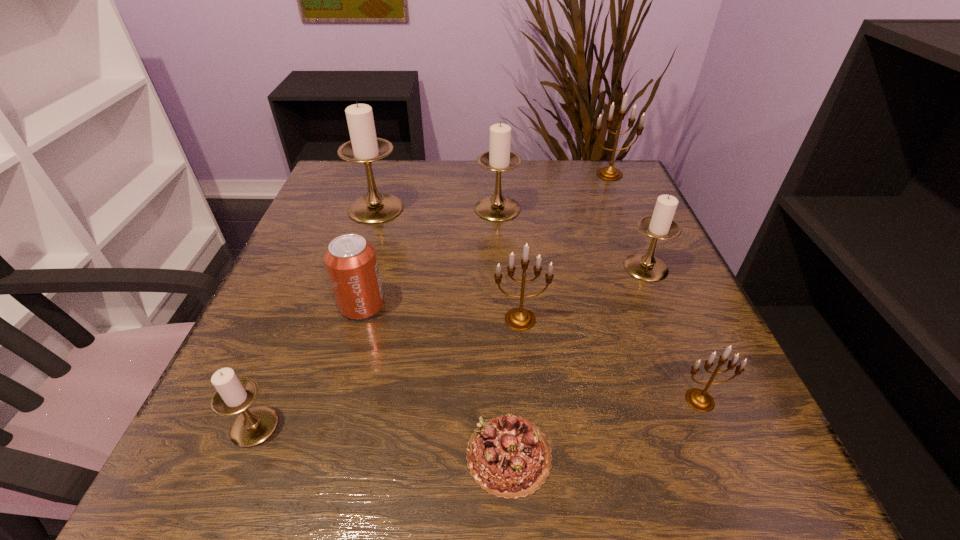
The image size is (960, 540). In the image, there is a desktop. In order to click on vacant space at the left edge in this screenshot , I will do `click(262, 363)`.

You are a GUI agent. You are given a task and a screenshot of the screen. Output one action in this format:
    pyautogui.click(x=<x>, y=<y>)
    Task: Click on the vacant space at the right edge of the desktop
    
    Given the screenshot: What is the action you would take?
    pyautogui.click(x=665, y=247)

Where is `vacant space at the far left corner`? vacant space at the far left corner is located at coordinates (329, 187).

At what (x,y) coordinates should I click in order to perform the action: click on vacant space at the near left corner of the desktop. Please return your answer as a coordinate pair (x, y). The width and height of the screenshot is (960, 540). Looking at the image, I should click on (268, 488).

In the image, there is a desktop. At what (x,y) coordinates should I click in order to perform the action: click on vacant space at the far right corner. Please return your answer as a coordinate pair (x, y). Looking at the image, I should click on (636, 199).

In the image, there is a desktop. At what (x,y) coordinates should I click in order to perform the action: click on free space at the near right corner. Please return your answer as a coordinate pair (x, y). The width and height of the screenshot is (960, 540). Looking at the image, I should click on (783, 491).

Locate an element on the screen. empty space that is in between the orange can and the third smallest white candle holder is located at coordinates (430, 257).

At what (x,y) coordinates should I click in order to perform the action: click on blank region between the can and the third smallest white candle holder. Please return your answer as a coordinate pair (x, y). The height and width of the screenshot is (540, 960). Looking at the image, I should click on pos(430,257).

The width and height of the screenshot is (960, 540). I want to click on free space that is in between the biggest white candle holder and the shortest object, so click(x=443, y=332).

Locate an element on the screen. This screenshot has width=960, height=540. free space between the smallest gold candelabrum and the farthest candle holder is located at coordinates (655, 287).